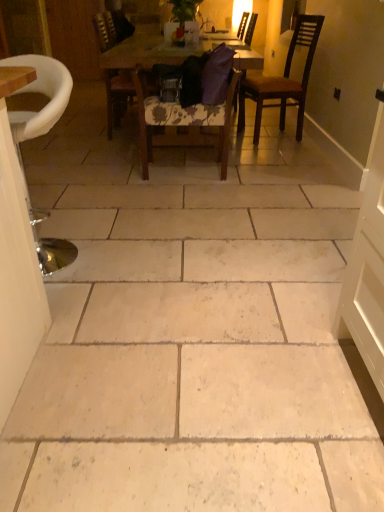
You are a GUI agent. You are given a task and a screenshot of the screen. Output one action in this format:
    pyautogui.click(x=<x>, y=<y>)
    Task: Click on the vacant space underneath floral fabric chair at center, which is counted as the fourth chair, starting from the back (from a real-world perspective)
    The width and height of the screenshot is (384, 512).
    Given the screenshot: What is the action you would take?
    [184, 169]